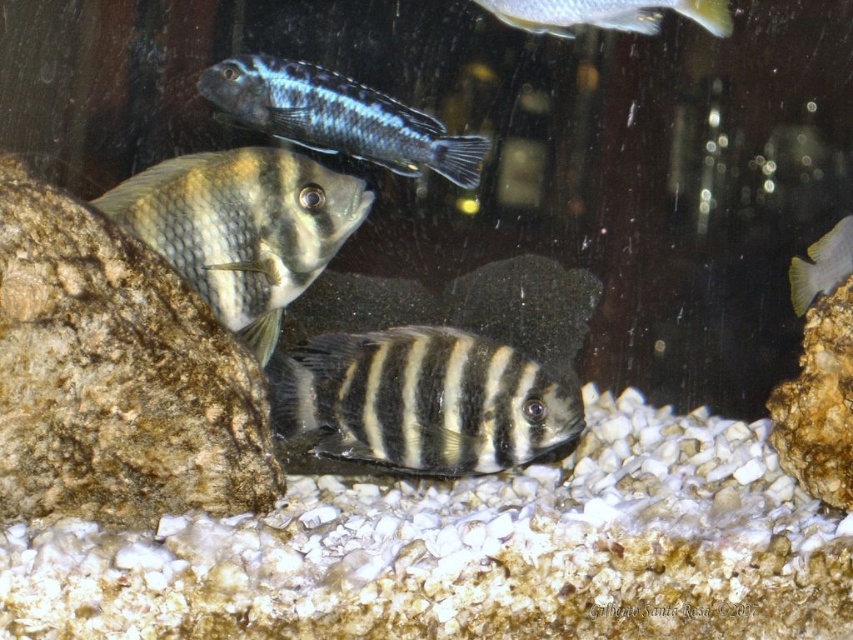
Question: Which object is positioned closest to the black striped fish at center?

Choices:
 (A) blue glossy fish at upper center
 (B) shiny silver fish at upper center
 (C) brown rock at right

Answer: (A)

Question: Does blue glossy fish at upper center have a greater width compared to shiny silver fish at upper center?

Choices:
 (A) no
 (B) yes

Answer: (B)

Question: Can you confirm if black striped fish at center is positioned to the left of striped matte fish at center?

Choices:
 (A) yes
 (B) no

Answer: (B)

Question: Is black striped fish at center further to camera compared to striped matte fish at center?

Choices:
 (A) yes
 (B) no

Answer: (A)

Question: Which object is positioned farthest from the yellow matte fish at right?

Choices:
 (A) brown rough rock at lower left
 (B) blue glossy fish at upper center
 (C) shiny silver fish at upper center
 (D) striped matte fish at center

Answer: (A)

Question: Which point appears farthest from the camera in this image?

Choices:
 (A) (325, 129)
 (B) (32, 173)
 (C) (808, 323)

Answer: (A)